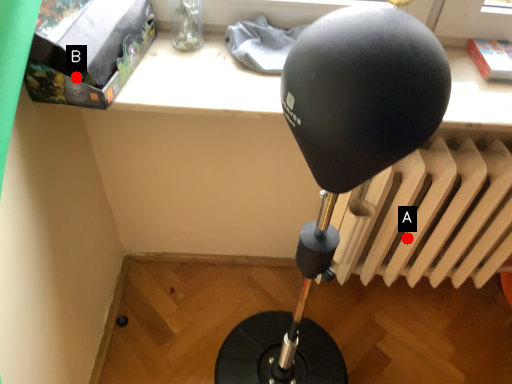
Question: Two points are circled on the image, labeled by A and B beside each circle. Which point is closer to the camera taking this photo?

Choices:
 (A) A is closer
 (B) B is closer

Answer: (B)